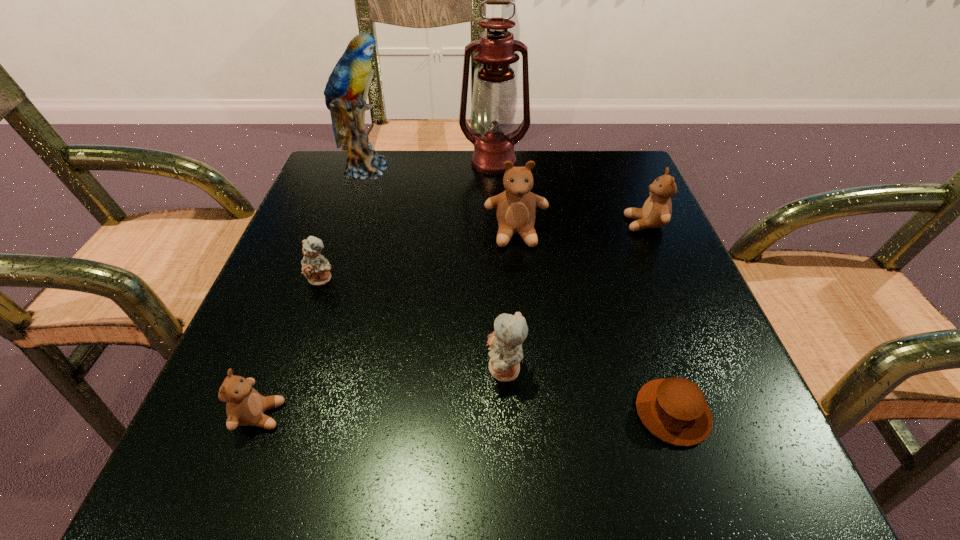
This screenshot has width=960, height=540. Identify the location of vacant space located 0.330m on the front-facing side of the nearer blue teddy bear. (263, 370).

I want to click on free space located 0.140m on the front-facing side of the nearer blue teddy bear, so [x=392, y=370].

This screenshot has width=960, height=540. What are the coordinates of `blank area located on the front-facing side of the nearer blue teddy bear` in the screenshot? It's located at (297, 370).

Find the location of a particular element. The width and height of the screenshot is (960, 540). free space located on the front-facing side of the fourth nearest object is located at coordinates (301, 338).

This screenshot has height=540, width=960. Find the location of `free space located on the front-facing side of the nearest brown teddy bear`. free space located on the front-facing side of the nearest brown teddy bear is located at coordinates (428, 415).

At what (x,y) coordinates should I click in order to perform the action: click on vacant space located 0.330m on the back of the brown muffin. Please return your answer as a coordinate pair (x, y). Looking at the image, I should click on (613, 235).

The image size is (960, 540). What are the coordinates of `oil lamp present at the far edge` in the screenshot? It's located at pyautogui.click(x=495, y=97).

The image size is (960, 540). I want to click on parrot located at the far edge, so click(x=349, y=77).

Identify the location of teddy bear at the near edge. (245, 406).

Image resolution: width=960 pixels, height=540 pixels. Find the location of `muffin that is positioned at the near edge`. muffin that is positioned at the near edge is located at coordinates (675, 410).